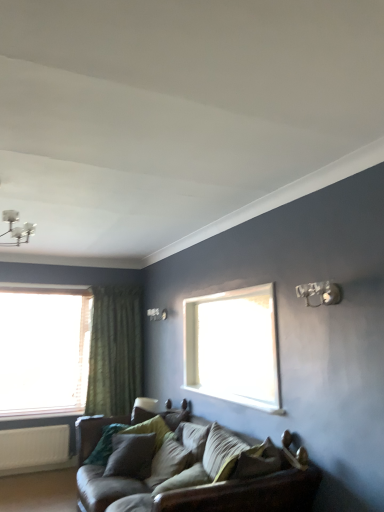
Question: Is point (165, 453) closer or farther from the camera than point (102, 370)?

Choices:
 (A) closer
 (B) farther

Answer: (A)

Question: From their relative heights in the image, would you say leather couch at lower center is taller or shorter than green textured curtain at left?

Choices:
 (A) tall
 (B) short

Answer: (B)

Question: Which is farther from the leather couch at lower center?

Choices:
 (A) green textured curtain at left
 (B) metallic silver light fixture at upper right
 (C) velvet green pillow at center, which appears as the second pillow when viewed from the front
 (D) white matte radiator at lower left
 (E) velvet green pillow at center, marked as the 3th pillow in a back-to-front arrangement

Answer: (D)

Question: Considering the real-world distances, which object is closest to the velvet green pillow at center, which is the first pillow in back-to-front order?

Choices:
 (A) white matte radiator at lower left
 (B) velvet green pillow at center, which appears as the second pillow when viewed from the front
 (C) velvet green pillow at center, marked as the 3th pillow in a back-to-front arrangement
 (D) green textured curtain at left
 (E) metallic silver light fixture at upper right

Answer: (B)